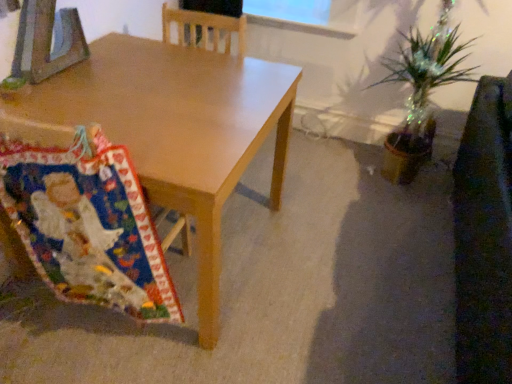
Question: From the image's perspective, is dark brown leather swivel chair at right above or below matte wood desk at center?

Choices:
 (A) below
 (B) above

Answer: (A)

Question: Is dark brown leather swivel chair at right situated inside matte wood desk at center or outside?

Choices:
 (A) inside
 (B) outside

Answer: (B)

Question: Estimate the real-world distances between objects in this image. Which object is closer to the multicolored fabric at lower left?

Choices:
 (A) dark brown leather swivel chair at right
 (B) matte wood desk at center

Answer: (B)

Question: Considering the real-world distances, which object is closest to the multicolored fabric at lower left?

Choices:
 (A) dark brown leather swivel chair at right
 (B) matte wood desk at center

Answer: (B)